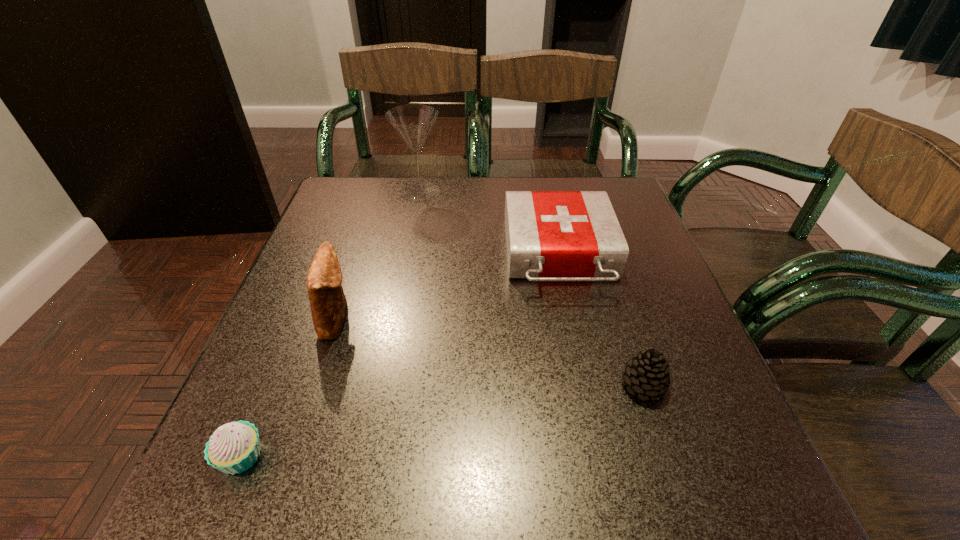
At what (x,y) coordinates should I click in order to perform the action: click on pinecone that is at the right edge. Please return your answer as a coordinate pair (x, y). Looking at the image, I should click on (648, 374).

Locate an element on the screen. the first-aid kit present at the right edge is located at coordinates (550, 235).

I want to click on object present at the near left corner, so click(234, 447).

Image resolution: width=960 pixels, height=540 pixels. What are the coordinates of `object positioned at the far right corner` in the screenshot? It's located at (550, 235).

In the image, there is a desktop. Where is `vacant space at the far edge`? The image size is (960, 540). vacant space at the far edge is located at coordinates (460, 178).

Identify the location of vacant space at the near edge of the desktop. (530, 520).

Find the location of `free space at the left edge of the desktop`. free space at the left edge of the desktop is located at coordinates (293, 303).

Where is `free space at the right edge of the desktop`? The height and width of the screenshot is (540, 960). free space at the right edge of the desktop is located at coordinates (688, 319).

You are a GUI agent. You are given a task and a screenshot of the screen. Output one action in this format:
    pyautogui.click(x=<x>, y=<y>)
    Task: Click on the free space at the near left corner of the desktop
    Image resolution: width=960 pixels, height=540 pixels.
    Given the screenshot: What is the action you would take?
    pyautogui.click(x=294, y=469)

You are a GUI agent. You are given a task and a screenshot of the screen. Output one action in this format:
    pyautogui.click(x=<x>, y=<y>)
    Task: Click on the free space at the near right corner
    The image size is (960, 540).
    Given the screenshot: What is the action you would take?
    pyautogui.click(x=663, y=471)